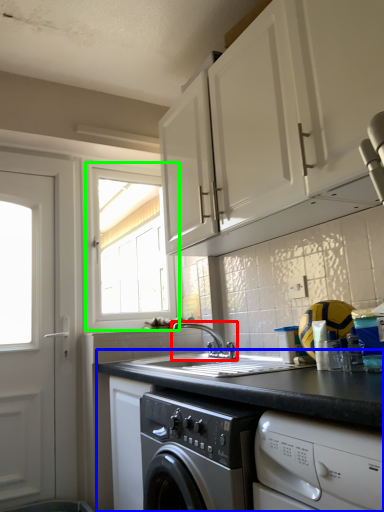
Question: Estimate the real-world distances between objects in this image. Which object is closer to tap (highlighted by a red box), countertop (highlighted by a blue box) or window (highlighted by a green box)?

Choices:
 (A) countertop
 (B) window

Answer: (A)